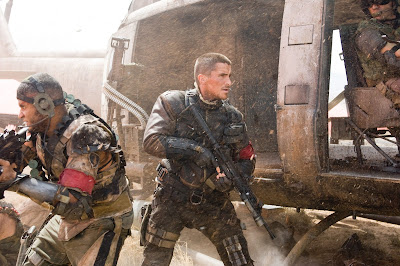
Image resolution: width=400 pixels, height=266 pixels. Find the location of `seat`. seat is located at coordinates (361, 128).